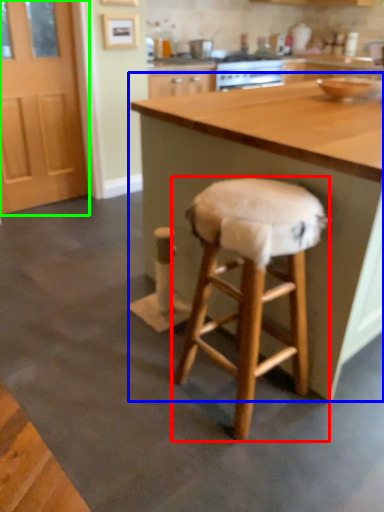
Question: Estimate the real-world distances between objects in this image. Which object is closer to stool (highlighted by a red box), table (highlighted by a blue box) or screen door (highlighted by a green box)?

Choices:
 (A) table
 (B) screen door

Answer: (A)